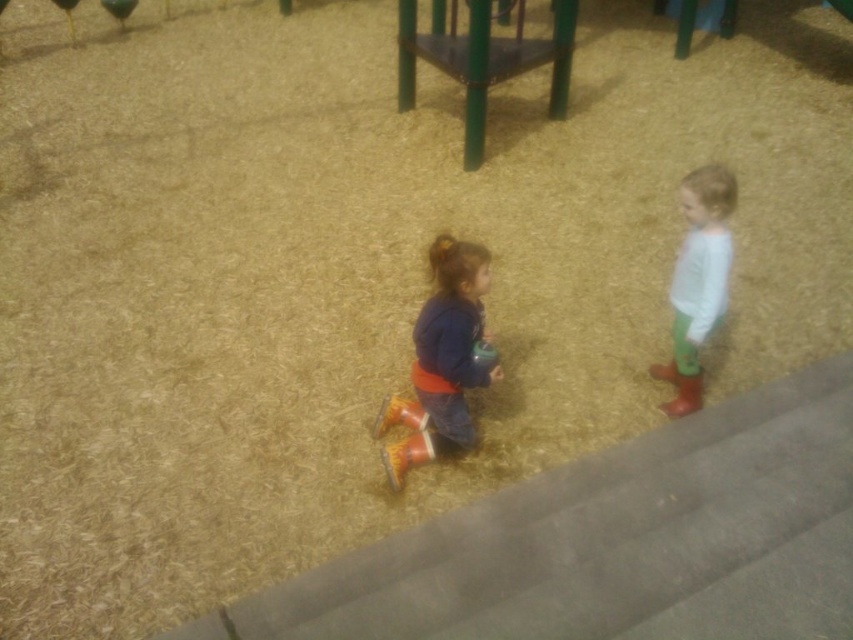
You are a drone operator trying to capture a photo of the two children on the playground. You need to ensure that the point at (x=461, y=372) and the point at (x=689, y=237) are both visible in the frame. Based on their positions, which point should be closer to the front of the image?

Point at (x=461, y=372) is in front of point at (x=689, y=237), so it will appear closer to the front of the image.

You are a parent trying to find your child who is wearing orange boots. You see the matte orange boots at center and the white matte shirt at right. Which object is wider? The question must include both object labels exactly as given.

The matte orange boots at center are wider than the white matte shirt at right.